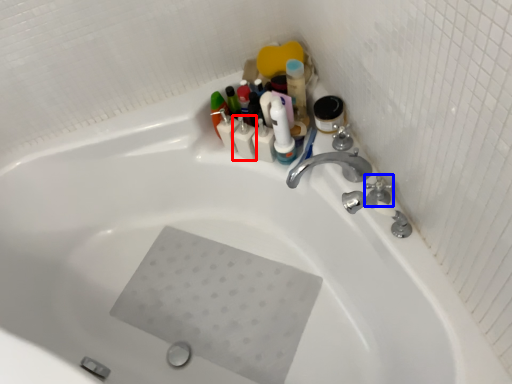
Question: Among these objects, which one is nearest to the camera, toiletry (highlighted by a red box) or plumbing fixture (highlighted by a blue box)?

Choices:
 (A) toiletry
 (B) plumbing fixture

Answer: (B)